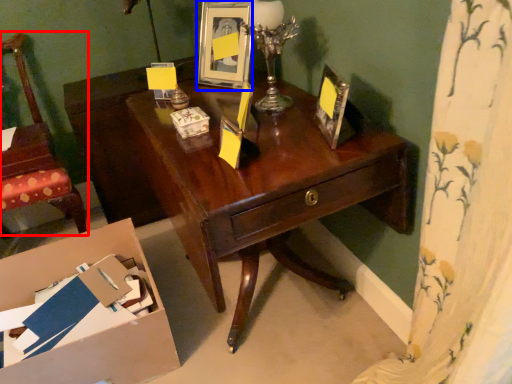
Question: Which object appears farthest to the camera in this image, chair (highlighted by a red box) or picture frame (highlighted by a blue box)?

Choices:
 (A) chair
 (B) picture frame

Answer: (B)